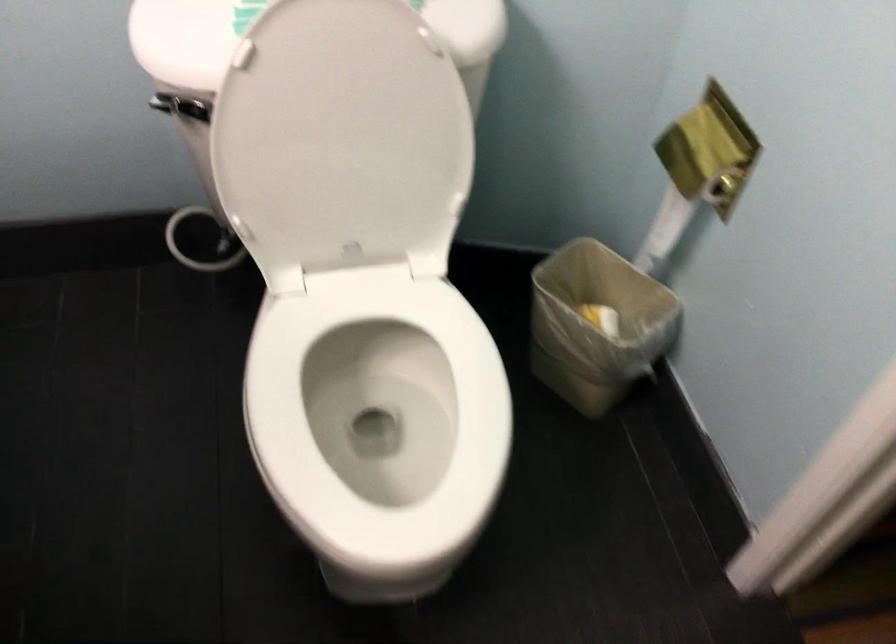
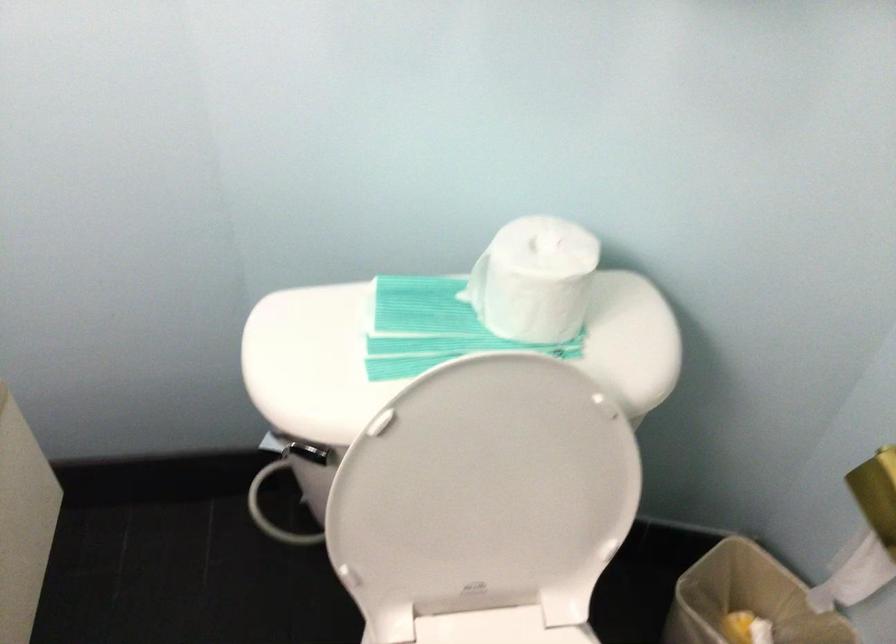
Where in the second image is the point corresponding to the point at 342,138 from the first image?

(486, 496)